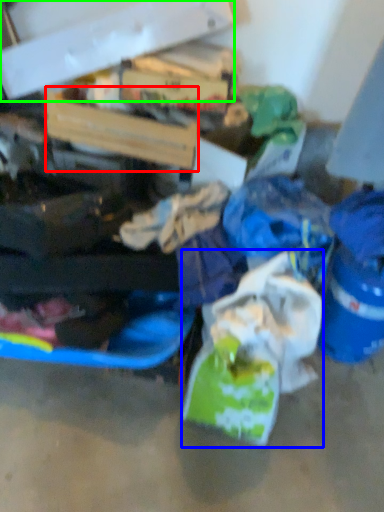
Question: Considering the real-world distances, which object is farthest from box (highlighted by a red box)? plastic bag (highlighted by a blue box) or box (highlighted by a green box)?

Choices:
 (A) plastic bag
 (B) box

Answer: (A)